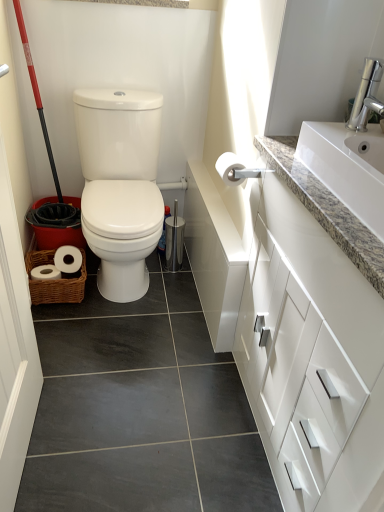
The height and width of the screenshot is (512, 384). I want to click on white matte toilet paper at upper right, so click(x=230, y=168).

Describe the element at coordinates (313, 338) in the screenshot. I see `white glossy cabinet at upper right` at that location.

Image resolution: width=384 pixels, height=512 pixels. Describe the element at coordinates (367, 95) in the screenshot. I see `silver metallic faucet at upper right` at that location.

The width and height of the screenshot is (384, 512). I want to click on white matte toilet paper at upper right, so click(x=230, y=168).

Is white granite sink at upper right next to white glossy cabinet at upper right and touching it?

No.

Is point (370, 93) closer to viewer compared to point (320, 354)?

No, (370, 93) is behind (320, 354).

Which object is positioned more to the left, white granite sink at upper right or white glossy cabinet at upper right?

Positioned to the left is white glossy cabinet at upper right.

Can you confirm if white matte toilet paper at upper right is wider than white glossy cabinet at upper right?

No, white matte toilet paper at upper right is not wider than white glossy cabinet at upper right.

Is white matte toilet paper at upper right not within white glossy cabinet at upper right?

Yes, white matte toilet paper at upper right is located beyond the bounds of white glossy cabinet at upper right.

From the image's perspective, is white matte toilet paper at upper right positioned above or below white glossy cabinet at upper right?

white matte toilet paper at upper right is situated higher than white glossy cabinet at upper right in the image.

Is white granite sink at upper right at the back of white glossy cabinet at upper right?

No, white glossy cabinet at upper right's orientation is not away from white granite sink at upper right.

Which is more to the right, white glossy cabinet at upper right or white granite sink at upper right?

white granite sink at upper right is more to the right.

Is white granite sink at upper right completely or partially inside white glossy cabinet at upper right?

No, white granite sink at upper right is not a part of white glossy cabinet at upper right.

Is white granite sink at upper right facing towards silver metallic faucet at upper right?

No, white granite sink at upper right is not oriented towards silver metallic faucet at upper right.

From their relative heights in the image, would you say white granite sink at upper right is taller or shorter than silver metallic faucet at upper right?

Clearly, white granite sink at upper right is shorter compared to silver metallic faucet at upper right.

Can you tell me how much white granite sink at upper right and silver metallic faucet at upper right differ in facing direction?

The angular difference between white granite sink at upper right and silver metallic faucet at upper right is 0.229 degrees.

Which of these two, white granite sink at upper right or silver metallic faucet at upper right, is thinner?

silver metallic faucet at upper right is thinner.

Which is farther, (368, 75) or (226, 173)?

Point (226, 173)

How different are the orientations of silver metallic faucet at upper right and white matte toilet paper at upper right in degrees?

The angular difference between silver metallic faucet at upper right and white matte toilet paper at upper right is 90 degrees.

From the image's perspective, does silver metallic faucet at upper right appear higher than white matte toilet paper at upper right?

Yes, from the image's perspective, silver metallic faucet at upper right is above white matte toilet paper at upper right.

Could you tell me if silver metallic faucet at upper right is turned towards white matte toilet paper at upper right?

No, silver metallic faucet at upper right is not turned towards white matte toilet paper at upper right.

From a real-world perspective, who is located higher, white glossy cabinet at upper right or white matte toilet paper at upper right?

white matte toilet paper at upper right, from a real-world perspective.

How many degrees apart are the facing directions of white glossy cabinet at upper right and white matte toilet paper at upper right?

They differ by 90.2 degrees in their facing directions.

How far apart are white glossy cabinet at upper right and white matte toilet paper at upper right?

They are 20.43 inches apart.

Considering the sizes of objects white glossy cabinet at upper right and white matte toilet paper at upper right in the image provided, who is smaller, white glossy cabinet at upper right or white matte toilet paper at upper right?

white matte toilet paper at upper right.

Is the surface of white glossy cabinet at upper right in direct contact with silver metallic faucet at upper right?

There is a gap between white glossy cabinet at upper right and silver metallic faucet at upper right.

Is white glossy cabinet at upper right at the right side of silver metallic faucet at upper right?

In fact, white glossy cabinet at upper right is to the left of silver metallic faucet at upper right.

Considering the relative sizes of white glossy cabinet at upper right and silver metallic faucet at upper right in the image provided, is white glossy cabinet at upper right bigger than silver metallic faucet at upper right?

Yes.

Does point (307, 500) appear closer or farther from the camera than point (368, 85)?

Point (307, 500) is closer to the camera than point (368, 85).

You are a GUI agent. You are given a task and a screenshot of the screen. Output one action in this format:
    pyautogui.click(x=<x>, y=<y>)
    Task: Click on the sink that is on the right side of white glossy cabinet at upper right
    
    Given the screenshot: What is the action you would take?
    pyautogui.click(x=351, y=153)

I want to click on toilet paper behind the white glossy cabinet at upper right, so click(x=230, y=168).

Looking at the image, which one is located closer to white granite sink at upper right, white matte toilet paper at upper right or silver metallic faucet at upper right?

silver metallic faucet at upper right lies closer to white granite sink at upper right than the other object.

When comparing their distances from white glossy cabinet at upper right, does white granite sink at upper right or silver metallic faucet at upper right seem closer?

Among the two, white granite sink at upper right is located nearer to white glossy cabinet at upper right.

Looking at the image, which one is located closer to white matte toilet paper at upper right, white glossy cabinet at upper right or silver metallic faucet at upper right?

The object closer to white matte toilet paper at upper right is silver metallic faucet at upper right.

When comparing their distances from white glossy cabinet at upper right, does silver metallic faucet at upper right or white granite sink at upper right seem further?

Among the two, silver metallic faucet at upper right is located further to white glossy cabinet at upper right.

Considering their positions, is white matte toilet paper at upper right positioned closer to white glossy cabinet at upper right than silver metallic faucet at upper right?

white matte toilet paper at upper right is positioned closer to the anchor white glossy cabinet at upper right.

Based on their spatial positions, is white granite sink at upper right or white glossy cabinet at upper right closer to silver metallic faucet at upper right?

white granite sink at upper right lies closer to silver metallic faucet at upper right than the other object.

Estimate the real-world distances between objects in this image. Which object is closer to silver metallic faucet at upper right, white matte toilet paper at upper right or white glossy cabinet at upper right?

The object closer to silver metallic faucet at upper right is white matte toilet paper at upper right.

Looking at the image, which one is located further to white glossy cabinet at upper right, white granite sink at upper right or white matte toilet paper at upper right?

white matte toilet paper at upper right lies further to white glossy cabinet at upper right than the other object.

Locate an element on the screen. The image size is (384, 512). faucet between white granite sink at upper right and white matte toilet paper at upper right in the front-back direction is located at coordinates (367, 95).

Where is `sink that lies between silver metallic faucet at upper right and white glossy cabinet at upper right from top to bottom`? The image size is (384, 512). sink that lies between silver metallic faucet at upper right and white glossy cabinet at upper right from top to bottom is located at coordinates (351, 153).

Identify the location of sink positioned between white glossy cabinet at upper right and white matte toilet paper at upper right from near to far. click(351, 153).

This screenshot has width=384, height=512. I want to click on faucet located between white glossy cabinet at upper right and white matte toilet paper at upper right in the depth direction, so click(x=367, y=95).